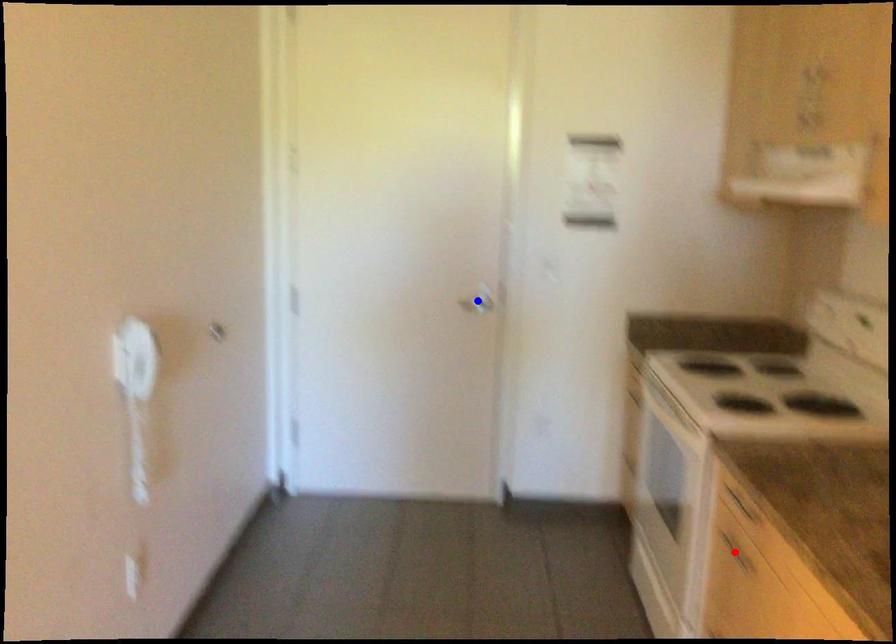
Question: In the image, two points are highlighted. Which point is nearer to the camera? Reply with the corresponding letter.

Choices:
 (A) blue point
 (B) red point

Answer: (B)